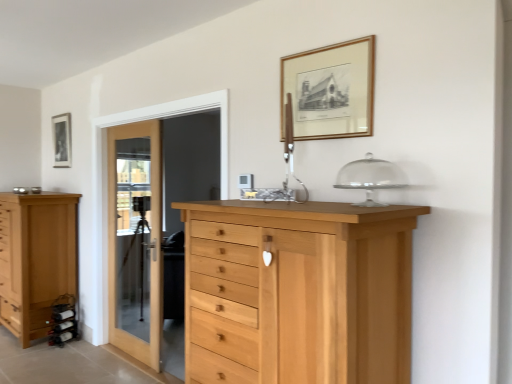
The height and width of the screenshot is (384, 512). In order to click on clear glass door at center in this screenshot , I will do `click(135, 239)`.

This screenshot has height=384, width=512. Describe the element at coordinates (36, 259) in the screenshot. I see `light brown wooden chest of drawers at left, placed as the 1th chest of drawers when sorted from back to front` at that location.

What do you see at coordinates (331, 90) in the screenshot? This screenshot has height=384, width=512. I see `gold wooden picture frame at upper center, which is counted as the 1th picture frame, starting from the right` at bounding box center [331, 90].

Where is `clear glass door at center`? The width and height of the screenshot is (512, 384). clear glass door at center is located at coordinates (135, 239).

You are a GUI agent. You are given a task and a screenshot of the screen. Output one action in this format:
    pyautogui.click(x=<x>, y=<y>)
    Task: Click on the chest of drawers behind the gold wooden picture frame at upper center, which appears as the 2th picture frame when viewed from the back
    The height and width of the screenshot is (384, 512).
    Given the screenshot: What is the action you would take?
    pyautogui.click(x=36, y=259)

Does light brown wooden chest of drawers at left, placed as the 1th chest of drawers when sorted from back to front, have a lesser width compared to gold wooden picture frame at upper center, the 1th picture frame from the front?

No, light brown wooden chest of drawers at left, placed as the 1th chest of drawers when sorted from back to front, is not thinner than gold wooden picture frame at upper center, the 1th picture frame from the front.

Could you tell me if light brown wooden chest of drawers at left, acting as the second chest of drawers starting from the right, is turned towards gold wooden picture frame at upper center, which is counted as the 1th picture frame, starting from the right?

No, light brown wooden chest of drawers at left, acting as the second chest of drawers starting from the right, is not aimed at gold wooden picture frame at upper center, which is counted as the 1th picture frame, starting from the right.

How many degrees apart are the facing directions of light brown wooden chest of drawers at left, the first chest of drawers when ordered from left to right, and gold wooden picture frame at upper center, which is counted as the 1th picture frame, starting from the right?

0.967 degrees.

Consider the image. Does clear glass door at center have a smaller size compared to matte black picture frame at upper left, the second picture frame positioned from the right?

No, clear glass door at center is not smaller than matte black picture frame at upper left, the second picture frame positioned from the right.

Which is in front, point (129, 281) or point (68, 155)?

The point (68, 155) is in front.

At what (x,y) coordinates should I click in order to perform the action: click on door below the matte black picture frame at upper left, the second picture frame positioned from the right (from the image's perspective). Please return your answer as a coordinate pair (x, y). Looking at the image, I should click on 135,239.

Which object is more forward, clear glass door at center or matte black picture frame at upper left, which is the second picture frame from front to back?

clear glass door at center is more forward.

Could you tell me if gold wooden picture frame at upper center, which appears as the 2th picture frame when viewed from the back, is facing light brown wooden chest of drawers at left, acting as the second chest of drawers starting from the front?

No.

From a real-world perspective, is gold wooden picture frame at upper center, marked as the 2th picture frame in a left-to-right arrangement, beneath light brown wooden chest of drawers at left, acting as the second chest of drawers starting from the front?

Actually, gold wooden picture frame at upper center, marked as the 2th picture frame in a left-to-right arrangement, is physically above light brown wooden chest of drawers at left, acting as the second chest of drawers starting from the front, in the real world.

Is light brown wooden chest of drawers at left, acting as the second chest of drawers starting from the right, a part of gold wooden picture frame at upper center, marked as the 2th picture frame in a left-to-right arrangement?

No, light brown wooden chest of drawers at left, acting as the second chest of drawers starting from the right, is not a part of gold wooden picture frame at upper center, marked as the 2th picture frame in a left-to-right arrangement.

Considering the relative sizes of gold wooden picture frame at upper center, which appears as the 2th picture frame when viewed from the back, and light brown wooden chest of drawers at left, placed as the 1th chest of drawers when sorted from back to front, in the image provided, is gold wooden picture frame at upper center, which appears as the 2th picture frame when viewed from the back, wider than light brown wooden chest of drawers at left, placed as the 1th chest of drawers when sorted from back to front,?

No.

Is natural wood chest of drawers at center, the second chest of drawers viewed from the left, positioned in front of matte black picture frame at upper left, which is the second picture frame from front to back?

Yes, it is.

Is the surface of natural wood chest of drawers at center, which is counted as the first chest of drawers, starting from the right, in direct contact with matte black picture frame at upper left, the second picture frame positioned from the right?

No, natural wood chest of drawers at center, which is counted as the first chest of drawers, starting from the right, is not next to matte black picture frame at upper left, the second picture frame positioned from the right.

From the image's perspective, which is below, natural wood chest of drawers at center, the 2th chest of drawers from the back, or matte black picture frame at upper left, which is the second picture frame from front to back?

natural wood chest of drawers at center, the 2th chest of drawers from the back.

Is natural wood chest of drawers at center, which is counted as the first chest of drawers, starting from the right, oriented away from matte black picture frame at upper left, the 1th picture frame from the back?

That's not correct — natural wood chest of drawers at center, which is counted as the first chest of drawers, starting from the right, is not looking away from matte black picture frame at upper left, the 1th picture frame from the back.

Considering the relative positions of light brown wooden chest of drawers at left, acting as the second chest of drawers starting from the right, and clear glass door at center in the image provided, is light brown wooden chest of drawers at left, acting as the second chest of drawers starting from the right, to the left of clear glass door at center from the viewer's perspective?

Yes, light brown wooden chest of drawers at left, acting as the second chest of drawers starting from the right, is to the left of clear glass door at center.

From a real-world perspective, is light brown wooden chest of drawers at left, acting as the second chest of drawers starting from the front, physically below clear glass door at center?

Indeed, from a real-world perspective, light brown wooden chest of drawers at left, acting as the second chest of drawers starting from the front, is positioned beneath clear glass door at center.

Is light brown wooden chest of drawers at left, placed as the 1th chest of drawers when sorted from back to front, far from clear glass door at center?

No, there isn't a large distance between light brown wooden chest of drawers at left, placed as the 1th chest of drawers when sorted from back to front, and clear glass door at center.

Based on the photo, is light brown wooden chest of drawers at left, placed as the 1th chest of drawers when sorted from back to front, not within natural wood chest of drawers at center, the 2th chest of drawers from the back?

Yes, light brown wooden chest of drawers at left, placed as the 1th chest of drawers when sorted from back to front, is not within natural wood chest of drawers at center, the 2th chest of drawers from the back.

Which of these two, light brown wooden chest of drawers at left, the first chest of drawers when ordered from left to right, or natural wood chest of drawers at center, the second chest of drawers viewed from the left, is smaller?

With smaller size is natural wood chest of drawers at center, the second chest of drawers viewed from the left.

You are a GUI agent. You are given a task and a screenshot of the screen. Output one action in this format:
    pyautogui.click(x=<x>, y=<y>)
    Task: Click on the chest of drawers behind the natural wood chest of drawers at center, marked as the 1th chest of drawers in a front-to-back arrangement
    This screenshot has height=384, width=512.
    Given the screenshot: What is the action you would take?
    pyautogui.click(x=36, y=259)

How many degrees apart are the facing directions of light brown wooden chest of drawers at left, acting as the second chest of drawers starting from the front, and natural wood chest of drawers at center, which is counted as the first chest of drawers, starting from the right?

The facing directions of light brown wooden chest of drawers at left, acting as the second chest of drawers starting from the front, and natural wood chest of drawers at center, which is counted as the first chest of drawers, starting from the right, are 0.899 degrees apart.

Which of these two, gold wooden picture frame at upper center, which appears as the 2th picture frame when viewed from the back, or clear glass door at center, stands shorter?

With less height is gold wooden picture frame at upper center, which appears as the 2th picture frame when viewed from the back.

Considering the relative sizes of gold wooden picture frame at upper center, which is counted as the 1th picture frame, starting from the right, and clear glass door at center in the image provided, is gold wooden picture frame at upper center, which is counted as the 1th picture frame, starting from the right, bigger than clear glass door at center?

Actually, gold wooden picture frame at upper center, which is counted as the 1th picture frame, starting from the right, might be smaller than clear glass door at center.

Is point (306, 136) closer to camera compared to point (150, 202)?

That is True.

Can you tell me how much gold wooden picture frame at upper center, marked as the 2th picture frame in a left-to-right arrangement, and clear glass door at center differ in facing direction?

The angular difference between gold wooden picture frame at upper center, marked as the 2th picture frame in a left-to-right arrangement, and clear glass door at center is 0.000614 degrees.

The image size is (512, 384). I want to click on the 2nd picture frame to the right when counting from the light brown wooden chest of drawers at left, acting as the second chest of drawers starting from the front, so click(331, 90).

You are a GUI agent. You are given a task and a screenshot of the screen. Output one action in this format:
    pyautogui.click(x=<x>, y=<y>)
    Task: Click on the picture frame to the left of clear glass door at center
    
    Given the screenshot: What is the action you would take?
    pyautogui.click(x=62, y=140)

Considering their positions, is matte black picture frame at upper left, the 1th picture frame from the back, positioned further to gold wooden picture frame at upper center, which appears as the 2th picture frame when viewed from the back, than natural wood chest of drawers at center, marked as the 1th chest of drawers in a front-to-back arrangement?

matte black picture frame at upper left, the 1th picture frame from the back, is positioned further to the anchor gold wooden picture frame at upper center, which appears as the 2th picture frame when viewed from the back.

Estimate the real-world distances between objects in this image. Which object is further from matte black picture frame at upper left, which is the second picture frame from front to back, gold wooden picture frame at upper center, the 1th picture frame from the front, or clear glass door at center?

Based on the image, gold wooden picture frame at upper center, the 1th picture frame from the front, appears to be further to matte black picture frame at upper left, which is the second picture frame from front to back.

When comparing their distances from natural wood chest of drawers at center, which is counted as the first chest of drawers, starting from the right, does gold wooden picture frame at upper center, which is counted as the 1th picture frame, starting from the right, or matte black picture frame at upper left, the second picture frame positioned from the right, seem closer?

gold wooden picture frame at upper center, which is counted as the 1th picture frame, starting from the right, lies closer to natural wood chest of drawers at center, which is counted as the first chest of drawers, starting from the right, than the other object.

When comparing their distances from light brown wooden chest of drawers at left, placed as the 1th chest of drawers when sorted from back to front, does clear glass door at center or natural wood chest of drawers at center, the second chest of drawers viewed from the left, seem closer?

clear glass door at center lies closer to light brown wooden chest of drawers at left, placed as the 1th chest of drawers when sorted from back to front, than the other object.

Considering their positions, is light brown wooden chest of drawers at left, placed as the 1th chest of drawers when sorted from back to front, positioned further to gold wooden picture frame at upper center, which appears as the 2th picture frame when viewed from the back, than clear glass door at center?

light brown wooden chest of drawers at left, placed as the 1th chest of drawers when sorted from back to front, is further to gold wooden picture frame at upper center, which appears as the 2th picture frame when viewed from the back.

Which object lies nearer to the anchor point gold wooden picture frame at upper center, which is counted as the 1th picture frame, starting from the right, clear glass door at center or matte black picture frame at upper left, the 1th picture frame from the back?

clear glass door at center is positioned closer to the anchor gold wooden picture frame at upper center, which is counted as the 1th picture frame, starting from the right.

Which object lies nearer to the anchor point clear glass door at center, matte black picture frame at upper left, the 1th picture frame from the back, or light brown wooden chest of drawers at left, acting as the second chest of drawers starting from the right?

Among the two, light brown wooden chest of drawers at left, acting as the second chest of drawers starting from the right, is located nearer to clear glass door at center.

From the image, which object appears to be farther from gold wooden picture frame at upper center, which is counted as the 1th picture frame, starting from the right, natural wood chest of drawers at center, the 2th chest of drawers from the back, or light brown wooden chest of drawers at left, acting as the second chest of drawers starting from the right?

Among the two, light brown wooden chest of drawers at left, acting as the second chest of drawers starting from the right, is located further to gold wooden picture frame at upper center, which is counted as the 1th picture frame, starting from the right.

Where is `picture frame between natural wood chest of drawers at center, marked as the 1th chest of drawers in a front-to-back arrangement, and matte black picture frame at upper left, the 1th picture frame from the back, from front to back`? This screenshot has height=384, width=512. picture frame between natural wood chest of drawers at center, marked as the 1th chest of drawers in a front-to-back arrangement, and matte black picture frame at upper left, the 1th picture frame from the back, from front to back is located at coordinates (331, 90).

Where is `picture frame between natural wood chest of drawers at center, the 2th chest of drawers from the back, and clear glass door at center in the front-back direction`? The width and height of the screenshot is (512, 384). picture frame between natural wood chest of drawers at center, the 2th chest of drawers from the back, and clear glass door at center in the front-back direction is located at coordinates (331, 90).

The height and width of the screenshot is (384, 512). In order to click on chest of drawers between natural wood chest of drawers at center, the 2th chest of drawers from the back, and matte black picture frame at upper left, the second picture frame positioned from the right, from front to back in this screenshot , I will do `click(36, 259)`.

Where is `chest of drawers between light brown wooden chest of drawers at left, the first chest of drawers when ordered from left to right, and gold wooden picture frame at upper center, marked as the 2th picture frame in a left-to-right arrangement, from left to right`? This screenshot has width=512, height=384. chest of drawers between light brown wooden chest of drawers at left, the first chest of drawers when ordered from left to right, and gold wooden picture frame at upper center, marked as the 2th picture frame in a left-to-right arrangement, from left to right is located at coordinates (297, 292).